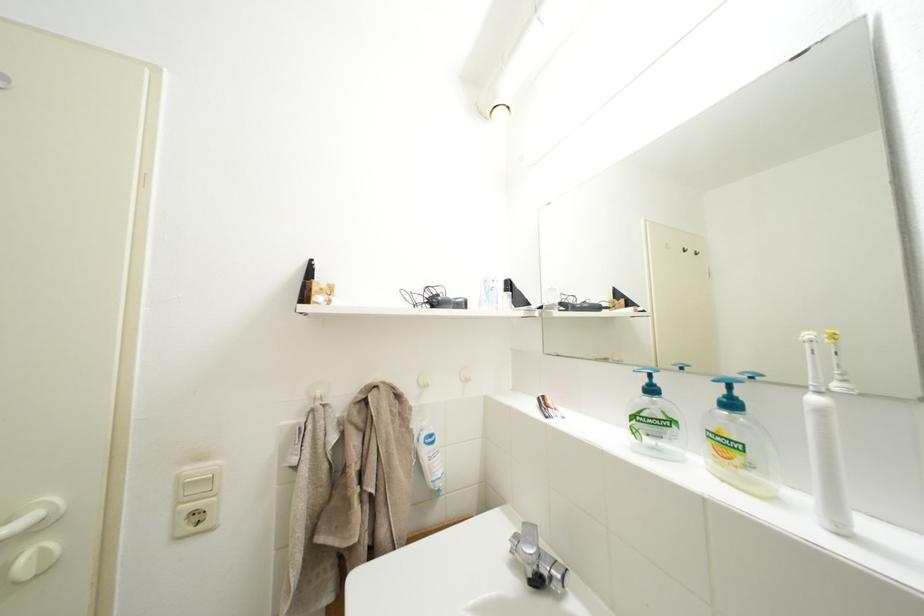
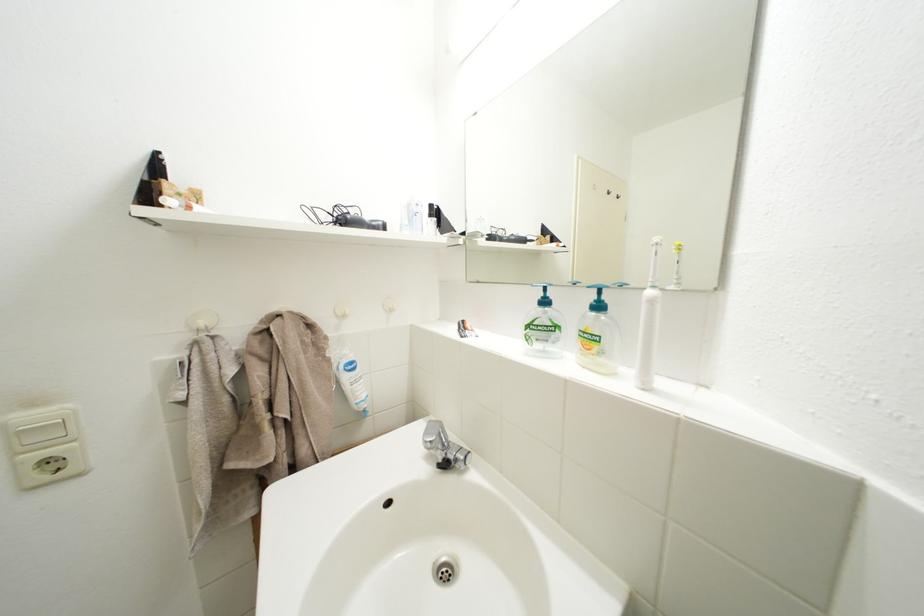
In the second image, find the point that corresponds to point (329, 398) in the first image.

(211, 329)